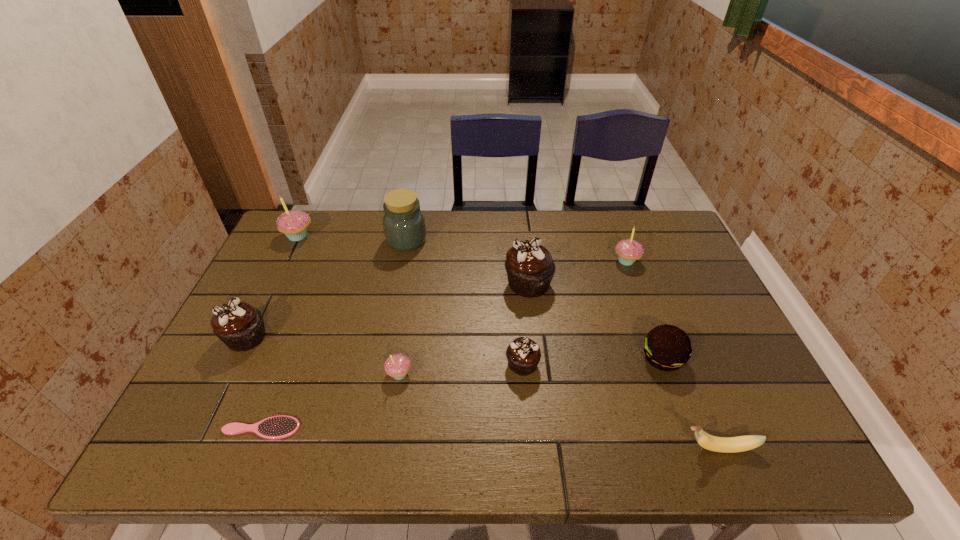
Locate an element on the screen. The image size is (960, 540). hairbrush that is positioned at the left edge is located at coordinates (275, 427).

At what (x,y) coordinates should I click in order to perform the action: click on patty that is at the right edge. Please return your answer as a coordinate pair (x, y). Looking at the image, I should click on (666, 347).

Where is `banana that is positioned at the right edge`? banana that is positioned at the right edge is located at coordinates (740, 443).

The width and height of the screenshot is (960, 540). I want to click on object at the far left corner, so click(x=294, y=223).

At what (x,y) coordinates should I click in order to perform the action: click on object at the near left corner. Please return your answer as a coordinate pair (x, y). This screenshot has width=960, height=540. Looking at the image, I should click on (275, 427).

The height and width of the screenshot is (540, 960). What are the coordinates of `object present at the near right corner` in the screenshot? It's located at (740, 443).

Image resolution: width=960 pixels, height=540 pixels. Find the location of `free space at the far edge of the desktop`. free space at the far edge of the desktop is located at coordinates (341, 250).

Image resolution: width=960 pixels, height=540 pixels. In the image, there is a desktop. Find the location of `vacant space at the near edge`. vacant space at the near edge is located at coordinates (592, 458).

The height and width of the screenshot is (540, 960). Identify the location of vacant space at the left edge of the desktop. (219, 393).

Identify the location of vacant space at the right edge of the desktop. This screenshot has height=540, width=960. (684, 306).